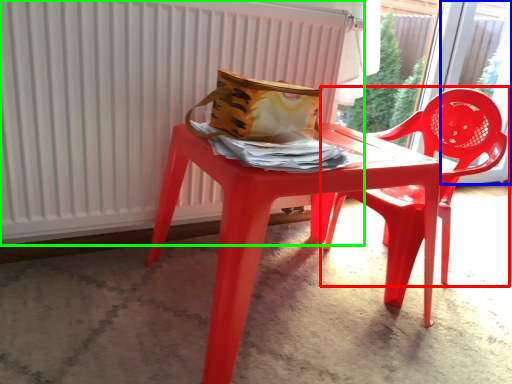
Question: Which is farther away from chair (highlighted by a red box)? window (highlighted by a blue box) or radiator (highlighted by a green box)?

Choices:
 (A) window
 (B) radiator

Answer: (A)